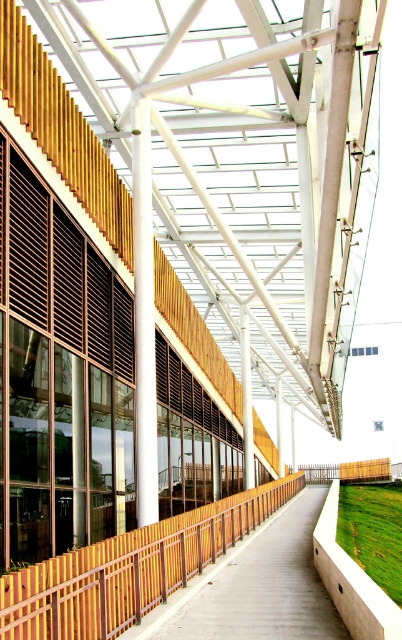
You are standing in the modern architectural structure and want to move from the wooden slats area to the glass doors. There are two points marked on the floor plan at coordinates point (385, 554) and point (250, 428). Which point should you walk towards to reach the glass doors first?

You should walk towards point (385, 554) because it is in front of point (250, 428), meaning it is closer to the glass doors.

You are standing at the entrance of the modern building and looking towards the white matte pillar at center. Can you see the green grass at lower right from this vantage point?

The green grass at lower right is positioned under the white matte pillar at center, so it is likely obstructed by the pillar and not visible from the entrance.

You are standing in front of the modern building and want to take a photo of both the yellow corrugated metal fence at center and the white smooth column at center. Which object should you focus on first to ensure both are in clear view?

You should focus on the yellow corrugated metal fence at center first because it is closer to the viewer than the white smooth column at center, so adjusting focus from near to far will help capture both clearly.